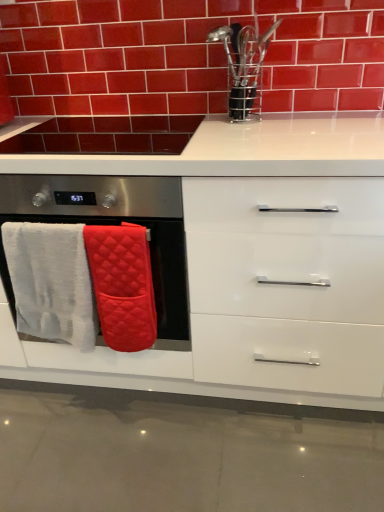
Question: Could you tell me if white quilted oven mitts at left is facing white fluffy bath towel at left, the first bath towel when ordered from left to right?

Choices:
 (A) no
 (B) yes

Answer: (B)

Question: From the image's perspective, does white quilted oven mitts at left appear higher than white fluffy bath towel at left, the first bath towel when ordered from left to right?

Choices:
 (A) yes
 (B) no

Answer: (A)

Question: Is white quilted oven mitts at left far away from white fluffy bath towel at left, the first bath towel when ordered from left to right?

Choices:
 (A) yes
 (B) no

Answer: (B)

Question: Is white quilted oven mitts at left to the left of white fluffy bath towel at left, arranged as the second bath towel when viewed from the right, from the viewer's perspective?

Choices:
 (A) yes
 (B) no

Answer: (B)

Question: Is white quilted oven mitts at left beside white fluffy bath towel at left, the first bath towel when ordered from left to right?

Choices:
 (A) no
 (B) yes

Answer: (A)

Question: Is glossy ceramic brick at upper center wider or thinner than white quilted oven mitts at left?

Choices:
 (A) thin
 (B) wide

Answer: (A)

Question: Is glossy ceramic brick at upper center in front of or behind white quilted oven mitts at left in the image?

Choices:
 (A) behind
 (B) front

Answer: (A)

Question: Based on their positions, is glossy ceramic brick at upper center located to the left or right of white quilted oven mitts at left?

Choices:
 (A) right
 (B) left

Answer: (A)

Question: From a real-world perspective, is glossy ceramic brick at upper center physically located above or below white quilted oven mitts at left?

Choices:
 (A) above
 (B) below

Answer: (A)

Question: Considering the positions of white glossy cabinet at center and white quilted oven mitts at left in the image, is white glossy cabinet at center taller or shorter than white quilted oven mitts at left?

Choices:
 (A) tall
 (B) short

Answer: (A)

Question: In terms of size, does white glossy cabinet at center appear bigger or smaller than white quilted oven mitts at left?

Choices:
 (A) big
 (B) small

Answer: (A)

Question: From a real-world perspective, is white glossy cabinet at center above or below white quilted oven mitts at left?

Choices:
 (A) above
 (B) below

Answer: (B)

Question: From the image's perspective, is white glossy cabinet at center positioned above or below white quilted oven mitts at left?

Choices:
 (A) above
 (B) below

Answer: (B)

Question: Is glossy ceramic brick at upper center taller or shorter than white glossy cabinet at center?

Choices:
 (A) short
 (B) tall

Answer: (A)

Question: Would you say glossy ceramic brick at upper center is to the left or to the right of white glossy cabinet at center in the picture?

Choices:
 (A) left
 (B) right

Answer: (B)